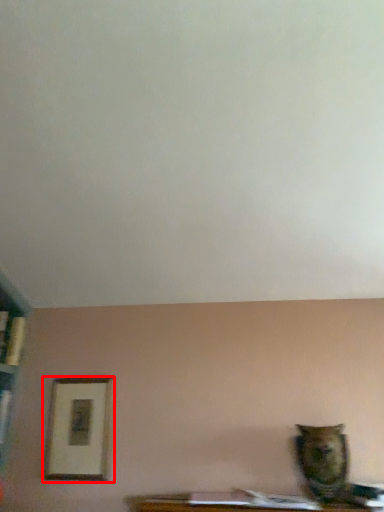
Question: Considering the relative positions of picture frame (annotated by the red box) and animal in the image provided, where is picture frame (annotated by the red box) located with respect to the staircase?

Choices:
 (A) left
 (B) right

Answer: (A)